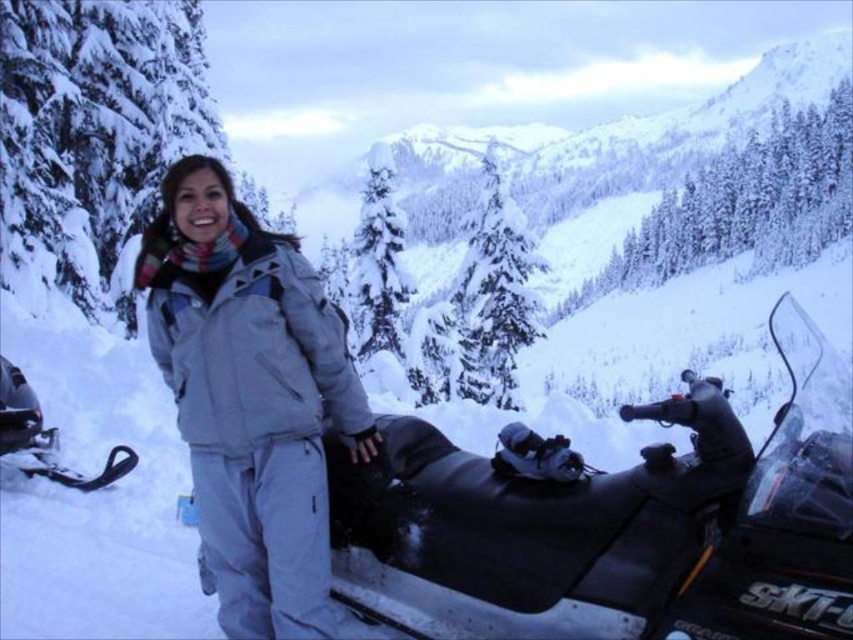
You are standing at the point with coordinates point (241, 528) and want to move to the point with coordinates point (387, 609). Based on the scene description, which direction should you move to reach your destination?

Point (387, 609) is in front of point (241, 528), so you should move forward to reach it.

You are planning to take a photo of the black rubber snowmobile at center and the light gray snowsuit at center. To ensure both are in focus, you need to know their positions relative to each other. Is the snowmobile above or below the snowsuit?

The black rubber snowmobile at center is located below the light gray snowsuit at center, so to capture both in focus, position the camera to account for the vertical separation between them.

You are planning to transport both the black rubber snowmobile at center and the light gray snowsuit at center in your pickup truck. The truck bed has a width of 1.5 meters. Can both items fit side by side in the truck bed without overlapping?

The black rubber snowmobile at center is wider than the light gray snowsuit at center. However, since the snowmobile is the wider item and its exact width isn